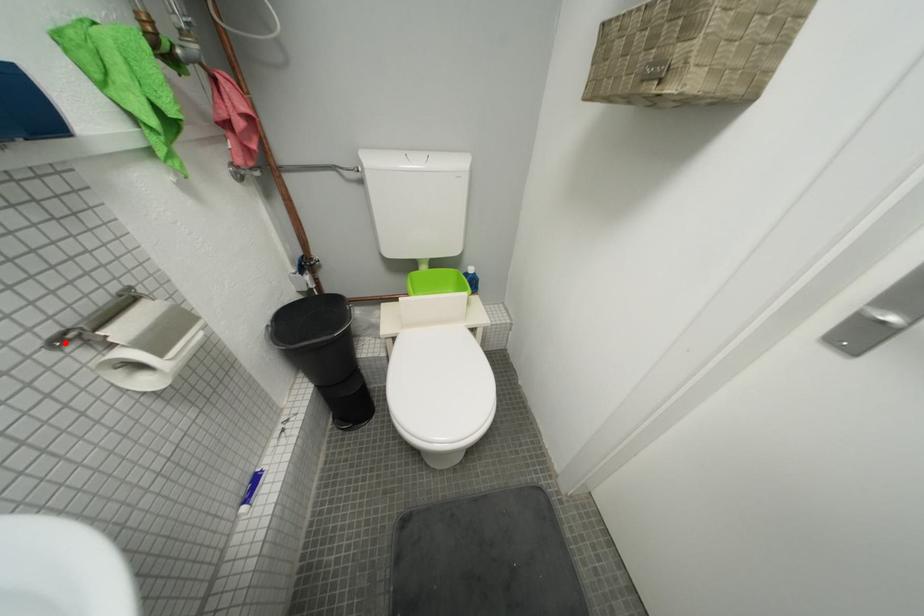
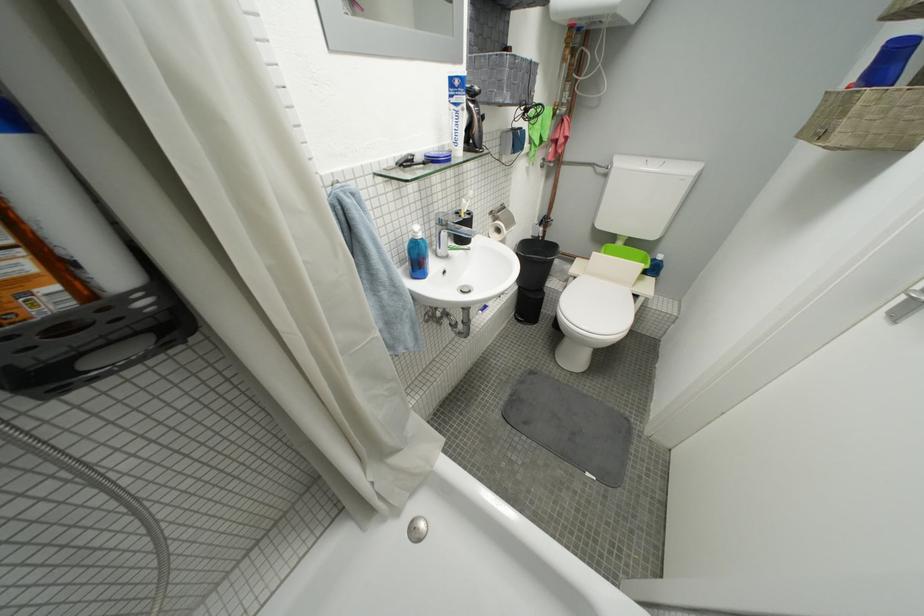
Question: I am providing you with two images of the same scene from different viewpoints. In image1, a red point is highlighted. Considering the same 3D point in image2, which of the following is correct?

Choices:
 (A) It is closer
 (B) It is farther

Answer: (A)